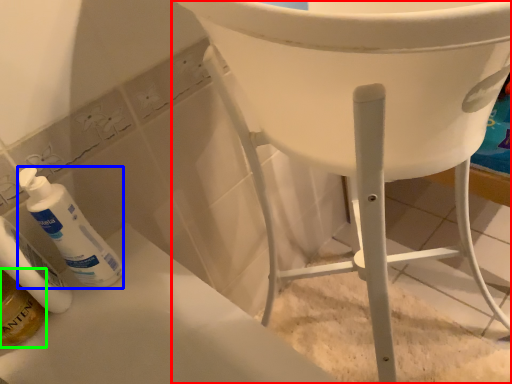
Question: Which object is positioned closest to furniture (highlighted by a red box)? Select from cleaning product (highlighted by a blue box) and mouthwash (highlighted by a green box).

Choices:
 (A) cleaning product
 (B) mouthwash

Answer: (A)